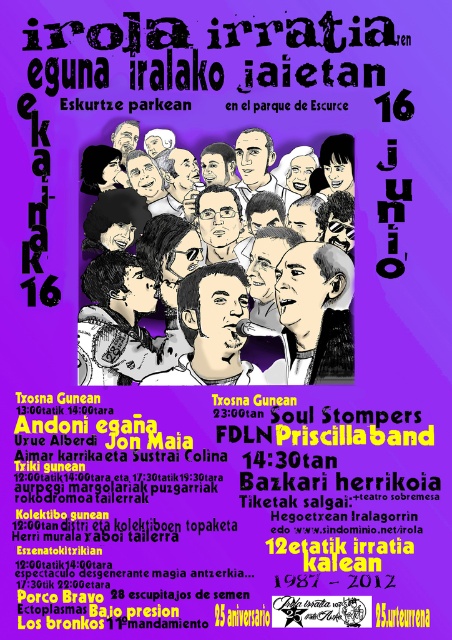
Question: Which object appears closest to the camera in this image?

Choices:
 (A) matte black microphone at center
 (B) black ink drawing of man at center

Answer: (B)

Question: Is gray hair pencil sketch of man at center below matte black microphone at center?

Choices:
 (A) yes
 (B) no

Answer: (B)

Question: Which object is closer to the camera taking this photo?

Choices:
 (A) matte black microphone at center
 (B) gray hair pencil sketch of man at center
 (C) black ink drawing of man at center

Answer: (C)

Question: Which of the following is the farthest from the observer?

Choices:
 (A) (183, 326)
 (B) (287, 310)

Answer: (A)

Question: Does black ink drawing of man at center appear on the left side of matte black microphone at center?

Choices:
 (A) no
 (B) yes

Answer: (B)

Question: Can you confirm if gray hair pencil sketch of man at center is positioned to the left of black ink drawing of man at center?

Choices:
 (A) yes
 (B) no

Answer: (B)